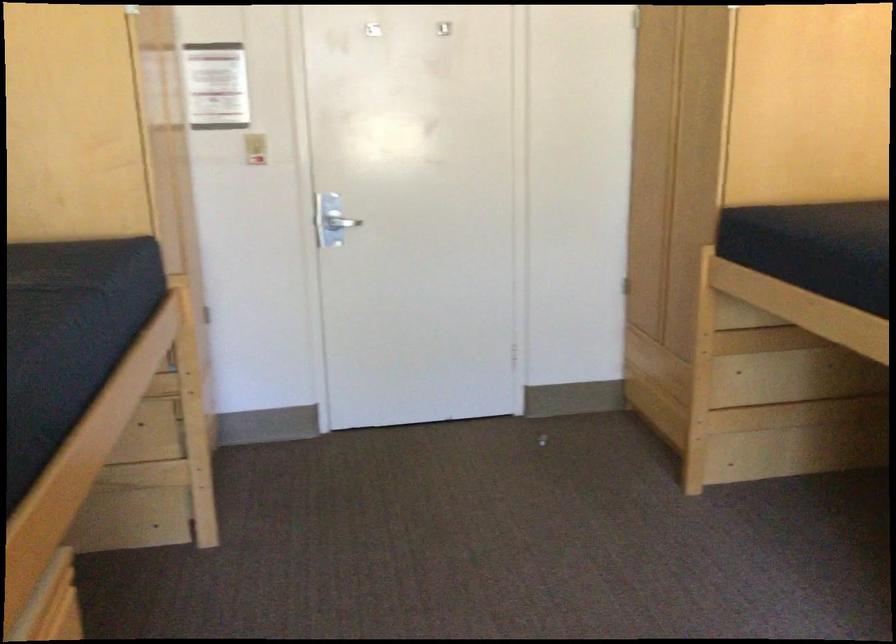
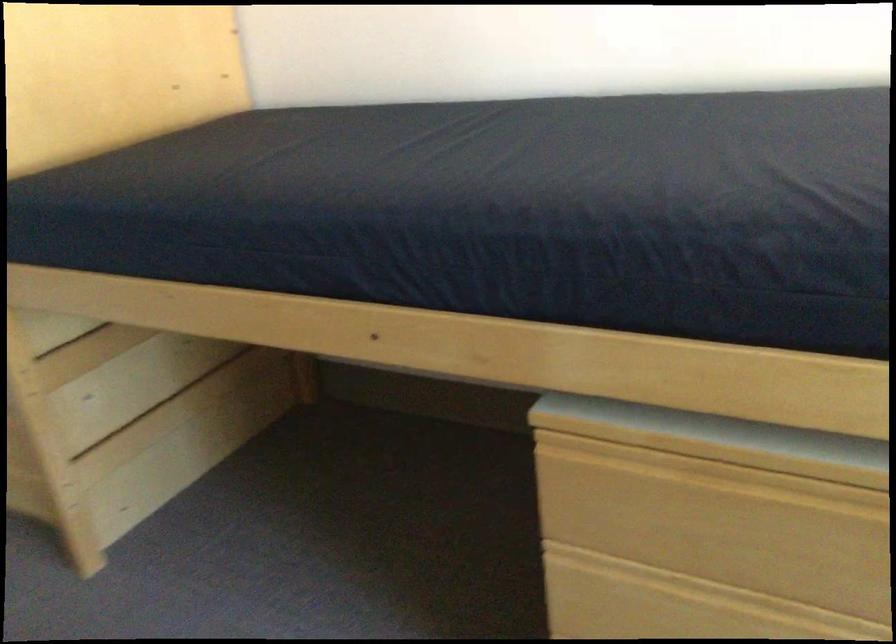
In the second image, find the point that corresponds to [767,433] in the first image.

(152, 458)